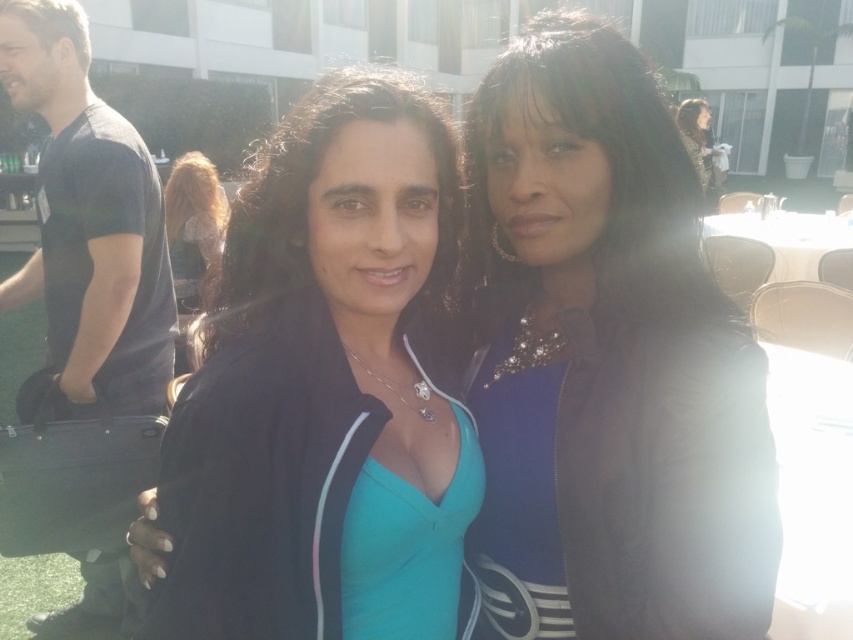
You are a photographer adjusting the camera settings to capture a closeup shot of both the satin black jacket at center and the dark brown hair at center. The camera has a depth of field that can focus clearly on objects within a 20 cm range. Will both objects be in focus simultaneously?

The distance between the satin black jacket at center and dark brown hair at center is 25.82 centimeters, which exceeds the 20 cm depth of field range. Therefore, both objects cannot be in focus at the same time.